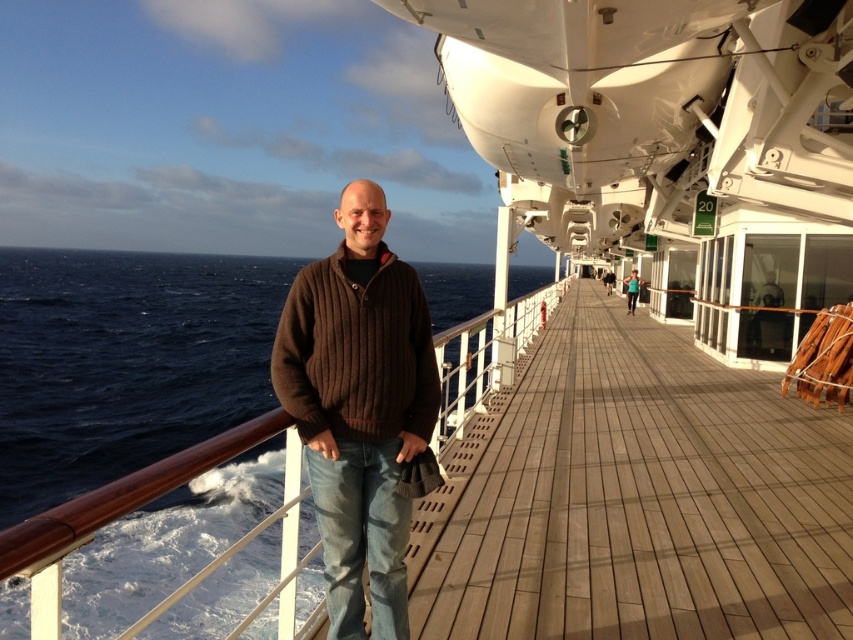
You are a photographer on the cruise ship deck. You want to take a photo of both the brown ribbed sweater at center and the brown knitted sweater at center. The camera you are using has a maximum focus range of 8 centimeters. Will both sweaters be in focus?

The brown ribbed sweater at center and brown knitted sweater at center are 8.28 centimeters apart. Since the distance between them exceeds the camera maximum focus range of 8 centimeters, both sweaters may not be in focus simultaneously.